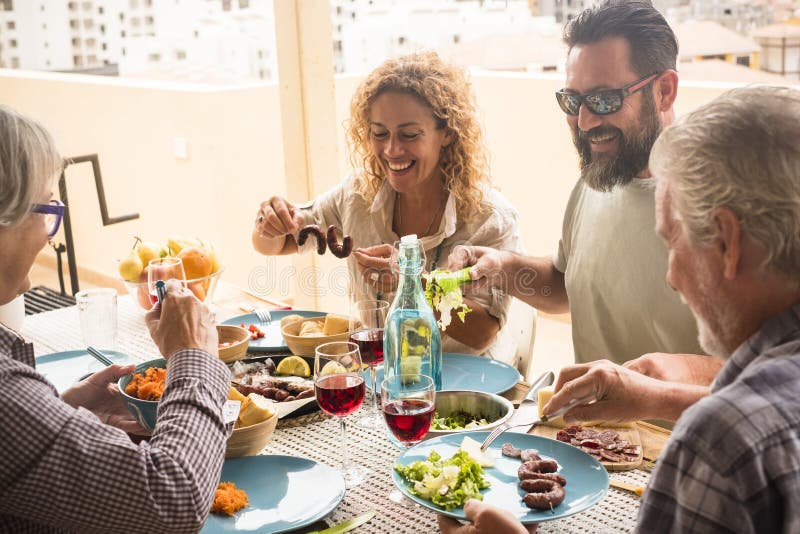
You are a GUI agent. You are given a task and a screenshot of the screen. Output one action in this format:
    pyautogui.click(x=<x>, y=<y>)
    Task: Click on the bottles/cups with liquid
    This screenshot has height=534, width=800.
    Given the screenshot: What is the action you would take?
    pyautogui.click(x=172, y=263), pyautogui.click(x=102, y=316), pyautogui.click(x=325, y=388), pyautogui.click(x=410, y=404), pyautogui.click(x=374, y=319), pyautogui.click(x=420, y=320)